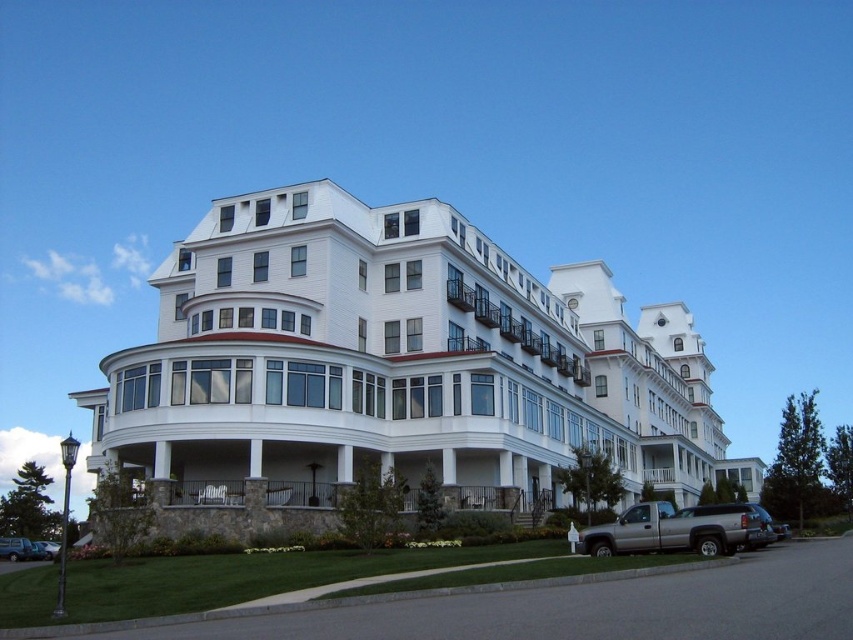
Question: From the image, what is the correct spatial relationship of white painted wood balcony at center in relation to silver metallic truck at lower right?

Choices:
 (A) left
 (B) right

Answer: (A)

Question: Observing the image, what is the correct spatial positioning of white glossy building at center in reference to white painted wood balcony at center?

Choices:
 (A) below
 (B) above

Answer: (A)

Question: Among these points, which one is nearest to the camera?

Choices:
 (A) (39, 554)
 (B) (42, 550)

Answer: (A)

Question: Estimate the real-world distances between objects in this image. Which object is closer to the white painted wood balcony at center?

Choices:
 (A) white glossy building at center
 (B) metallic silver suv at lower left

Answer: (A)

Question: Which object is the farthest from the silver metallic truck at lower right?

Choices:
 (A) metallic silver suv at lower left
 (B) white painted wood balcony at center
 (C) white glossy building at center
 (D) metallic silver car at lower left

Answer: (A)

Question: Can you confirm if white painted wood balcony at center is bigger than silver metallic truck at lower right?

Choices:
 (A) yes
 (B) no

Answer: (B)